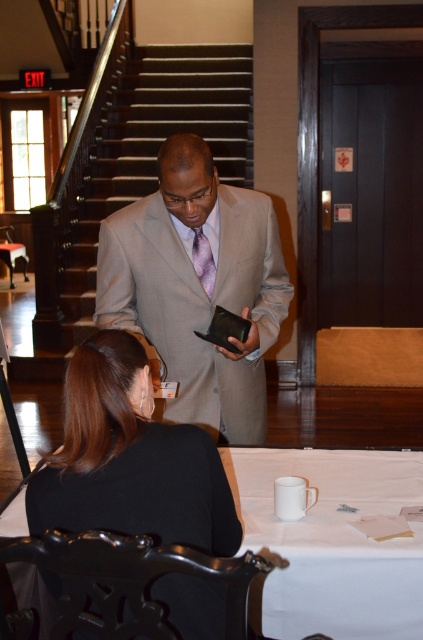
Is point (225, 436) more distant than point (272, 509)?

Yes, point (225, 436) is farther from viewer.

Does light beige suit at center appear over white matte table at center?

Yes, light beige suit at center is above white matte table at center.

Who is more distant from viewer, (158, 353) or (326, 474)?

Positioned behind is point (158, 353).

Locate an element on the screen. light beige suit at center is located at coordinates (197, 289).

Does point (316, 579) come in front of point (255, 452)?

Yes, it is in front of point (255, 452).

Image resolution: width=423 pixels, height=640 pixels. Describe the element at coordinates (332, 541) in the screenshot. I see `white matte table at center` at that location.

You are a GUI agent. You are given a task and a screenshot of the screen. Output one action in this format:
    pyautogui.click(x=<x>, y=<y>)
    Task: Click on the white matte table at center
    The height and width of the screenshot is (640, 423).
    Given the screenshot: What is the action you would take?
    pyautogui.click(x=332, y=541)

Is point (192, 362) closer to viewer compared to point (211, 257)?

That is False.

Describe the element at coordinates (197, 289) in the screenshot. I see `light beige suit at center` at that location.

Between point (159, 160) and point (206, 284), which one is positioned behind?

Point (206, 284)

Identify the location of light beige suit at center. The image size is (423, 640). (197, 289).